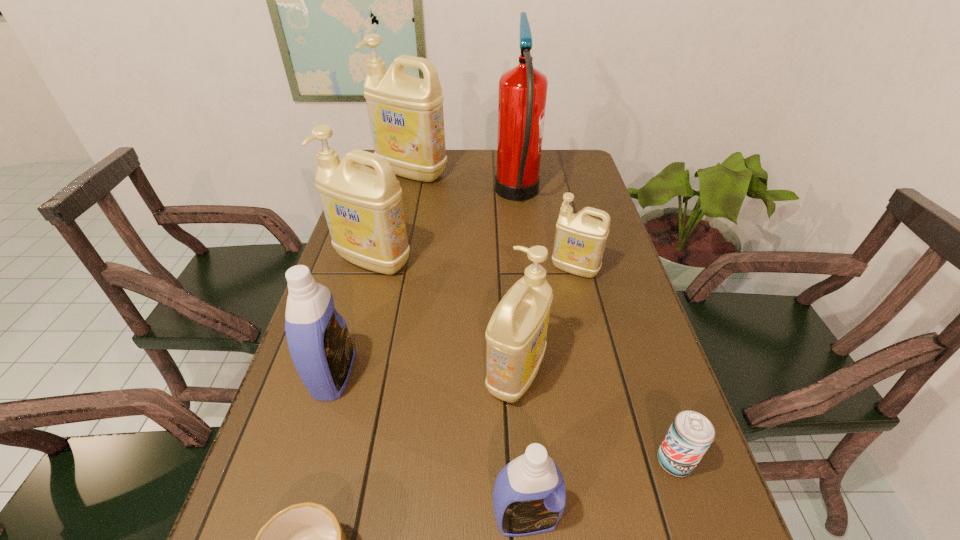
This screenshot has width=960, height=540. In the image, there is a desktop. Find the location of `vacant area at the far right corner`. vacant area at the far right corner is located at coordinates (569, 166).

Image resolution: width=960 pixels, height=540 pixels. In order to click on blank region between the third nearest object and the right blue detergent in this screenshot , I will do `click(600, 489)`.

Locate an element on the screen. Image resolution: width=960 pixels, height=540 pixels. free spot between the beer can and the red fire extinguisher is located at coordinates (596, 328).

This screenshot has height=540, width=960. I want to click on free space between the third beige detergent from left to right and the beer can, so click(595, 417).

I want to click on unoccupied position between the bigger blue detergent and the farthest detergent, so click(x=372, y=274).

You are a GUI agent. You are given a task and a screenshot of the screen. Output one action in this format:
    pyautogui.click(x=<x>, y=<y>)
    Task: Click on the vacant space in between the third smallest beige detergent and the rightmost beige detergent
    Image resolution: width=960 pixels, height=540 pixels.
    Given the screenshot: What is the action you would take?
    pyautogui.click(x=474, y=265)

Where is `vacant area that lies between the farthest detergent and the right blue detergent`? The height and width of the screenshot is (540, 960). vacant area that lies between the farthest detergent and the right blue detergent is located at coordinates tap(469, 345).

You are a GUI agent. You are given a task and a screenshot of the screen. Output one action in this format:
    pyautogui.click(x=<x>, y=<y>)
    Task: Click on the vacant area between the fifth shortest detergent and the third biggest beige detergent
    
    Given the screenshot: What is the action you would take?
    [x=444, y=318]

The height and width of the screenshot is (540, 960). I want to click on empty location between the farther blue detergent and the second tallest detergent, so click(353, 318).

Where is `empty space that is in between the right blue detergent and the smallest beige detergent`? Image resolution: width=960 pixels, height=540 pixels. empty space that is in between the right blue detergent and the smallest beige detergent is located at coordinates (550, 394).